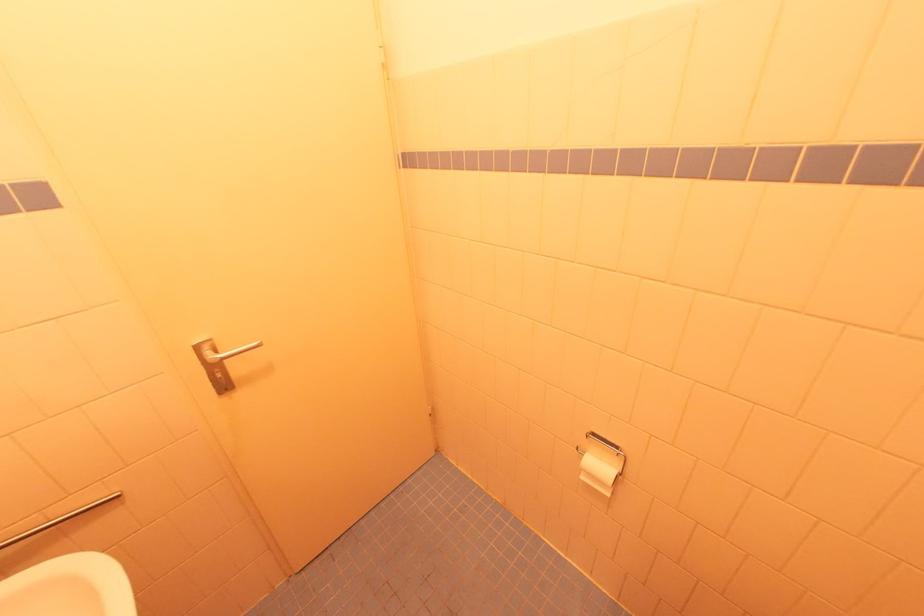
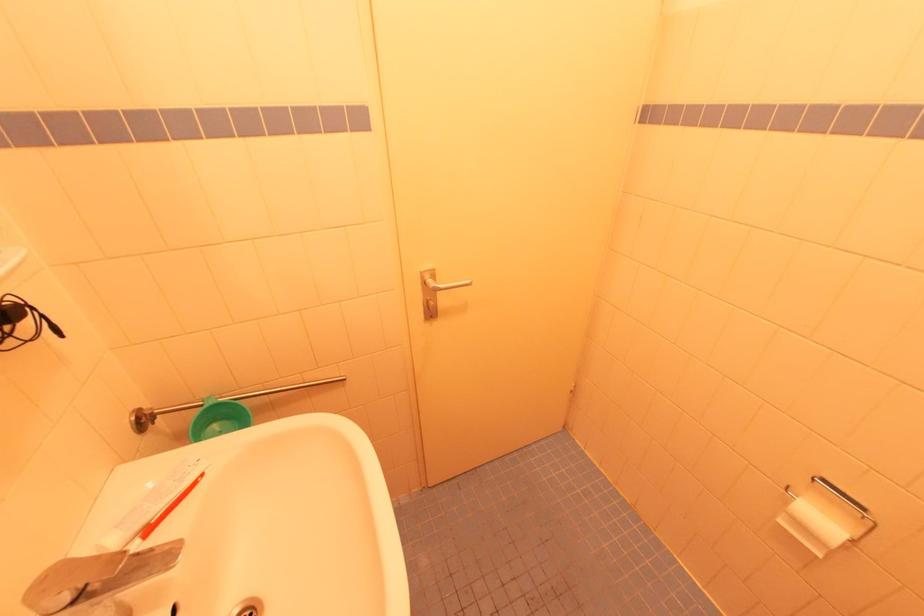
Question: The images are taken continuously from a first-person perspective. In which direction is your viewpoint rotating?

Choices:
 (A) Left
 (B) Right
 (C) Up
 (D) Down

Answer: (A)